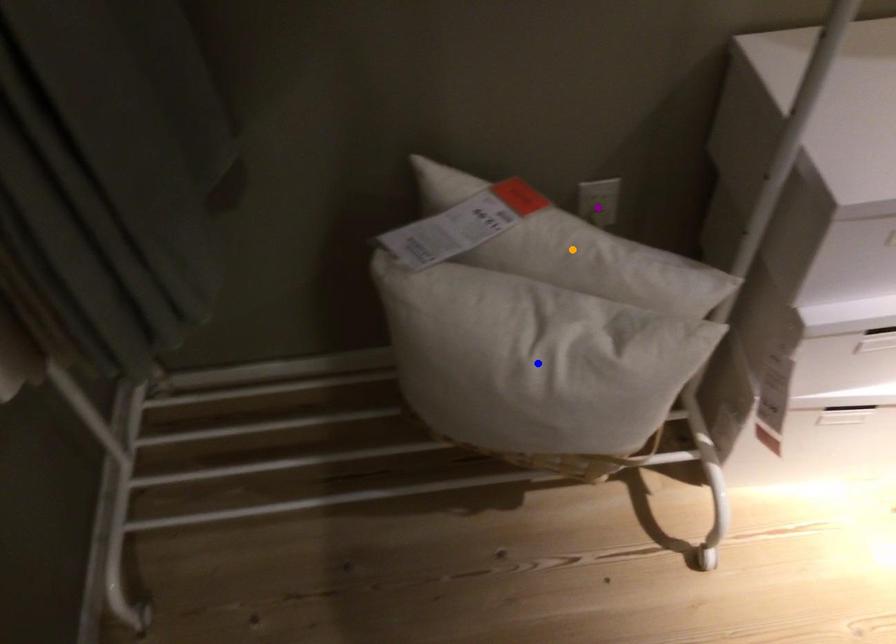
Order these from nearest to farthest:
purple point, blue point, orange point

blue point
orange point
purple point